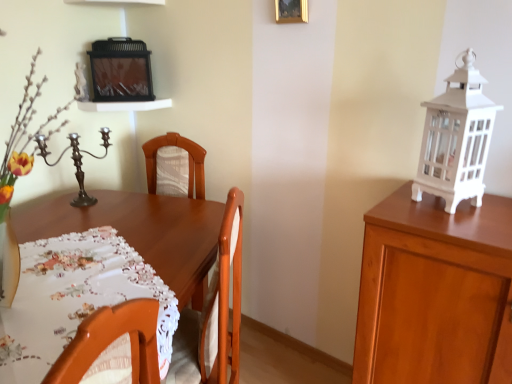
Measure the distance between white printed tablecloth at center and camera.

white printed tablecloth at center and camera are 4.19 feet apart from each other.

In order to face white printed tablecloth at center, should I rotate leftwards or rightwards?

To align with it, rotate left about 21.824°.

What do you see at coordinates (456, 139) in the screenshot? This screenshot has width=512, height=384. I see `white painted glass lantern at right` at bounding box center [456, 139].

At what (x,y) coordinates should I click in order to perform the action: click on white wood cabinet at right. Please return your answer as a coordinate pair (x, y). Looking at the image, I should click on (435, 292).

From the image's perspective, which one is positioned lower, polished bronze candle holder at left or white printed tablecloth at center?

From the image's view, white printed tablecloth at center is below.

From a real-world perspective, is polished bronze candle holder at left physically below white printed tablecloth at center?

Actually, polished bronze candle holder at left is physically above white printed tablecloth at center in the real world.

Is polished bronze candle holder at left facing away from white printed tablecloth at center?

That's not correct — polished bronze candle holder at left is not looking away from white printed tablecloth at center.

Image resolution: width=512 pixels, height=384 pixels. I want to click on table below the polished bronze candle holder at left (from a real-world perspective), so click(141, 232).

Is gold metallic picture frame at upper center behind white wood cabinet at right?

Yes.

Which of these two, gold metallic picture frame at upper center or white wood cabinet at right, is bigger?

Bigger between the two is white wood cabinet at right.

Is gold metallic picture frame at upper center taller than white wood cabinet at right?

No.

Is gold metallic picture frame at upper center aimed at white wood cabinet at right?

No, gold metallic picture frame at upper center is not facing towards white wood cabinet at right.

In terms of size, does gold metallic picture frame at upper center appear bigger or smaller than white printed tablecloth at center?

gold metallic picture frame at upper center is smaller than white printed tablecloth at center.

Considering the positions of objects gold metallic picture frame at upper center and white printed tablecloth at center in the image provided, who is more to the right, gold metallic picture frame at upper center or white printed tablecloth at center?

Positioned to the right is gold metallic picture frame at upper center.

From the image's perspective, does gold metallic picture frame at upper center appear lower than white printed tablecloth at center?

Incorrect, from the image's perspective, gold metallic picture frame at upper center is higher than white printed tablecloth at center.

Is gold metallic picture frame at upper center facing towards white printed tablecloth at center?

No.

Between white printed tablecloth at center and white painted glass lantern at right, which one is positioned in front?

white printed tablecloth at center.

I want to click on table located on the left of white painted glass lantern at right, so click(x=141, y=232).

Is white printed tablecloth at center not inside white painted glass lantern at right?

Indeed, white printed tablecloth at center is completely outside white painted glass lantern at right.

From the image's perspective, between white printed tablecloth at center and white painted glass lantern at right, who is located below?

white printed tablecloth at center is shown below in the image.

From the image's perspective, is white painted glass lantern at right above or below white wood cabinet at right?

white painted glass lantern at right is above white wood cabinet at right.

Based on the photo, between white painted glass lantern at right and white wood cabinet at right, which one has smaller size?

white painted glass lantern at right is smaller.

Based on their positions, is white painted glass lantern at right located to the left or right of white wood cabinet at right?

From the image, it's evident that white painted glass lantern at right is to the left of white wood cabinet at right.

Measure the distance from white painted glass lantern at right to white wood cabinet at right.

The distance of white painted glass lantern at right from white wood cabinet at right is 9.09 inches.

In terms of size, does gold metallic picture frame at upper center appear bigger or smaller than polished bronze candle holder at left?

Clearly, gold metallic picture frame at upper center is smaller in size than polished bronze candle holder at left.

Does point (306, 8) appear closer or farther from the camera than point (41, 140)?

Point (306, 8).

Is gold metallic picture frame at upper center to the right of polished bronze candle holder at left from the viewer's perspective?

Indeed, gold metallic picture frame at upper center is positioned on the right side of polished bronze candle holder at left.

From a real-world perspective, is gold metallic picture frame at upper center physically below polished bronze candle holder at left?

No.

Which point is more forward, [104,136] or [447,175]?

The point [447,175] is closer.

From a real-world perspective, which is physically above, polished bronze candle holder at left or white painted glass lantern at right?

From a 3D spatial view, white painted glass lantern at right is above.

Does polished bronze candle holder at left have a greater height compared to white painted glass lantern at right?

In fact, polished bronze candle holder at left may be shorter than white painted glass lantern at right.

The height and width of the screenshot is (384, 512). Identify the location of candle holder located above the white printed tablecloth at center (from a real-world perspective). (76, 162).

This screenshot has width=512, height=384. In order to click on cabinetry that is in front of the gold metallic picture frame at upper center in this screenshot , I will do `click(435, 292)`.

Based on their spatial positions, is white wood cabinet at right or white painted glass lantern at right closer to gold metallic picture frame at upper center?

The object closer to gold metallic picture frame at upper center is white painted glass lantern at right.

When comparing their distances from white wood cabinet at right, does gold metallic picture frame at upper center or polished bronze candle holder at left seem further?

polished bronze candle holder at left is positioned further to the anchor white wood cabinet at right.

From the image, which object appears to be nearer to gold metallic picture frame at upper center, white printed tablecloth at center or white painted glass lantern at right?

Based on the image, white painted glass lantern at right appears to be nearer to gold metallic picture frame at upper center.

Estimate the real-world distances between objects in this image. Which object is closer to white wood cabinet at right, polished bronze candle holder at left or gold metallic picture frame at upper center?

Among the two, gold metallic picture frame at upper center is located nearer to white wood cabinet at right.

Considering their positions, is white painted glass lantern at right positioned further to polished bronze candle holder at left than white printed tablecloth at center?

Among the two, white painted glass lantern at right is located further to polished bronze candle holder at left.

Which object lies further to the anchor point white painted glass lantern at right, gold metallic picture frame at upper center or white printed tablecloth at center?

Among the two, white printed tablecloth at center is located further to white painted glass lantern at right.

Which object lies nearer to the anchor point white wood cabinet at right, polished bronze candle holder at left or white painted glass lantern at right?

white painted glass lantern at right.

Looking at this image, when comparing their distances from white painted glass lantern at right, does white wood cabinet at right or gold metallic picture frame at upper center seem closer?

white wood cabinet at right.

I want to click on table between gold metallic picture frame at upper center and white wood cabinet at right vertically, so click(x=141, y=232).

Locate an element on the screen. The image size is (512, 384). candle holder between gold metallic picture frame at upper center and white printed tablecloth at center from top to bottom is located at coordinates (76, 162).

At what (x,y) coordinates should I click in order to perform the action: click on lantern located between polished bronze candle holder at left and white wood cabinet at right in the left-right direction. Please return your answer as a coordinate pair (x, y). The height and width of the screenshot is (384, 512). Looking at the image, I should click on (456, 139).

Locate an element on the screen. The image size is (512, 384). picture frame between polished bronze candle holder at left and white painted glass lantern at right from left to right is located at coordinates (291, 11).